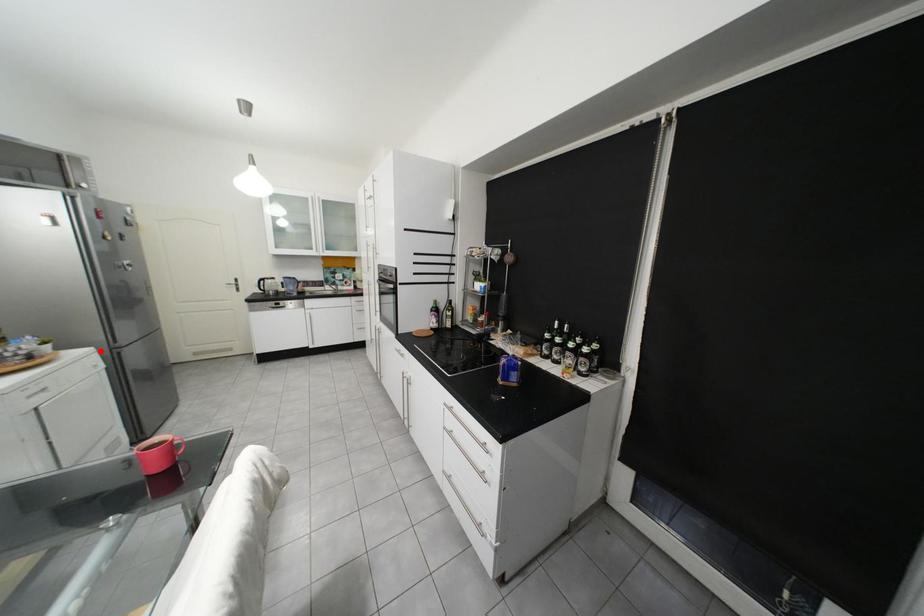
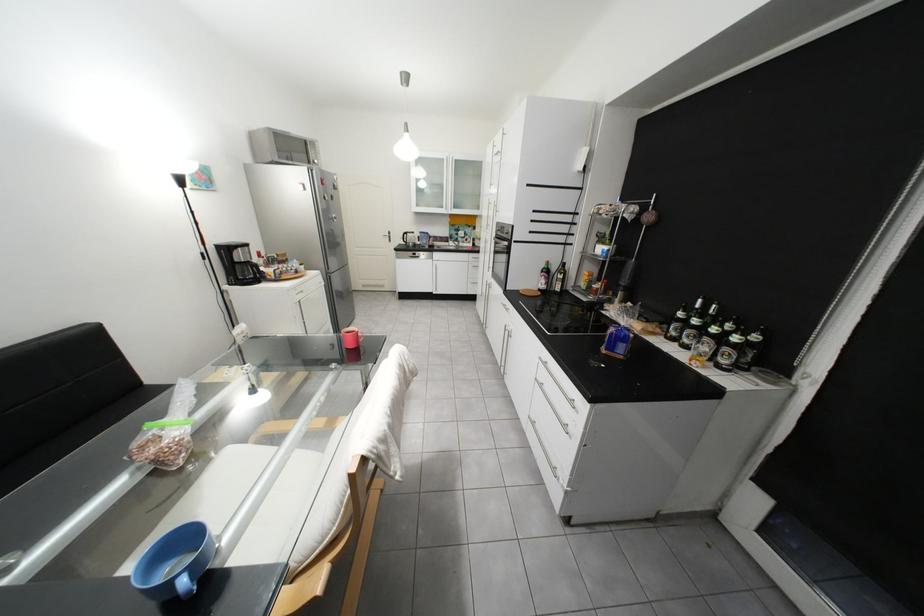
The point at the highlighted location is marked in the first image. Where is the corresponding point in the second image?

(330, 273)